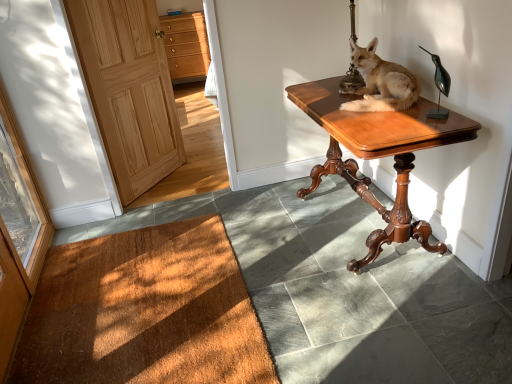
Locate an element on the screen. This screenshot has height=384, width=512. free space to the left of bronze metallic bird at upper right is located at coordinates (392, 117).